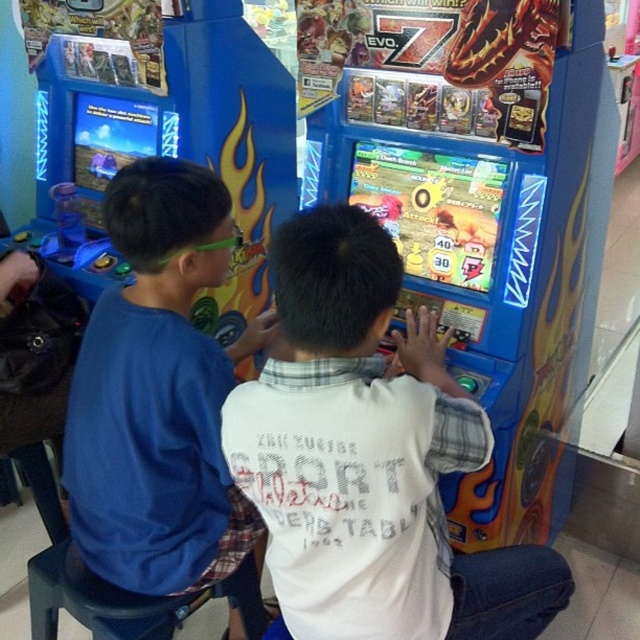
You are a parent trying to decide whether to let your child play the blue plastic arcade game at center. The blue cotton shirt at left is your child current clothing. Can your child play the game without the shirt getting damaged?

The blue plastic arcade game at center is larger in size than the blue cotton shirt at left, so the shirt is less likely to get damaged since the game is bigger and provides more space.

You are standing in front of the arcade game and want to reach the point marked at coordinates (308, 534). If your arm can extend 3 feet, can you reach that point without moving your feet?

The point at coordinates (308, 534) is 3.57 feet away from the viewer. Since your arm can only extend 3 feet, you cannot reach that point without moving your feet.

You are standing 6 feet away from the arcade game machine. There is a point at coordinates point (474, 168) on the machine. Can you reach this point with your hand if you extend your arm fully? Assume your arm length is 2.5 feet.

The distance of point (474, 168) from viewer is 5.10 feet. Since you are 6 feet away from the machine, the total distance to the point is 6 feet plus 5.10 feet, totaling 11.1 feet. Your arm is only 2.5 feet long, so you cannot reach the point.